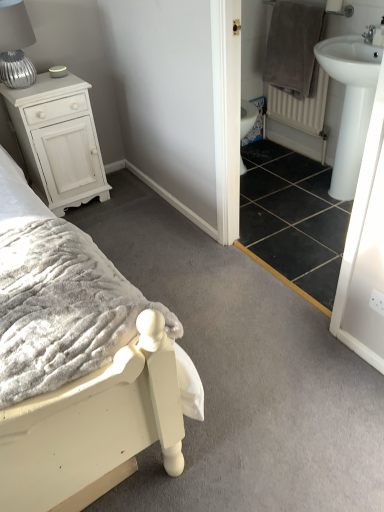
In order to click on spots to the right of white glossy bidet at center in this screenshot , I will do `click(266, 144)`.